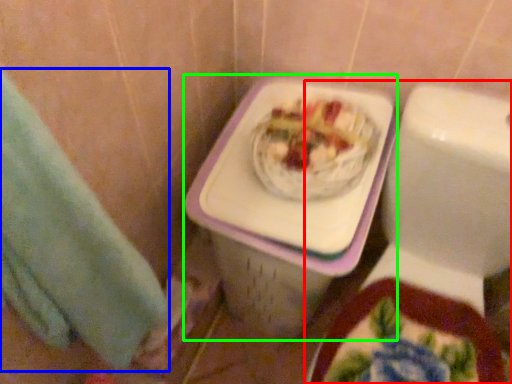
Question: Estimate the real-world distances between objects in this image. Which object is farther from toilet (highlighted by a red box), hand towel (highlighted by a blue box) or porcelain (highlighted by a green box)?

Choices:
 (A) hand towel
 (B) porcelain

Answer: (A)